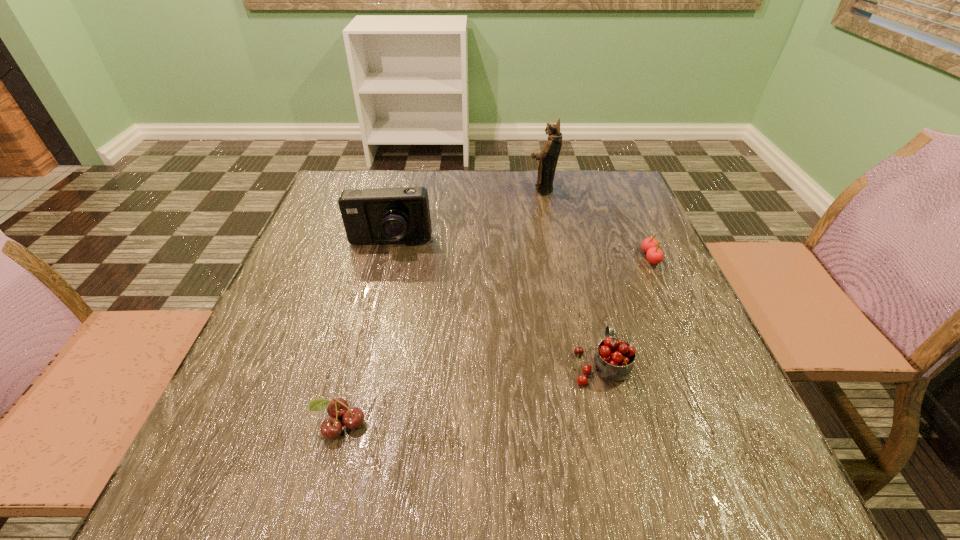
At what (x,y) coordinates should I click in order to perform the action: click on object that is at the right edge. Please return your answer as a coordinate pair (x, y). This screenshot has width=960, height=540. Looking at the image, I should click on (650, 245).

The image size is (960, 540). In order to click on blank space at the far edge of the desktop in this screenshot , I will do pos(558,178).

Locate an element on the screen. The image size is (960, 540). vacant region at the near edge is located at coordinates (531, 462).

Find the location of a particular element. The height and width of the screenshot is (540, 960). free space at the left edge is located at coordinates (x=344, y=231).

Find the location of a particular element. This screenshot has height=540, width=960. vacant position at the right edge of the desktop is located at coordinates (747, 442).

Find the location of a particular element. free space at the near left corner is located at coordinates (214, 499).

In the image, there is a desktop. Where is `free region at the far right corner`? The image size is (960, 540). free region at the far right corner is located at coordinates (623, 200).

The height and width of the screenshot is (540, 960). I want to click on free space between the farthest cherry and the tallest cherry, so click(626, 311).

You are a GUI agent. You are given a task and a screenshot of the screen. Output one action in this format:
    pyautogui.click(x=<x>, y=<y>)
    Task: Click on the free space between the second tallest object and the second cherry from right to left
    This screenshot has width=960, height=540.
    Given the screenshot: What is the action you would take?
    pyautogui.click(x=495, y=304)

Locate an element on the screen. The width and height of the screenshot is (960, 540). vacant space that's between the leftmost cherry and the tallest object is located at coordinates (441, 307).